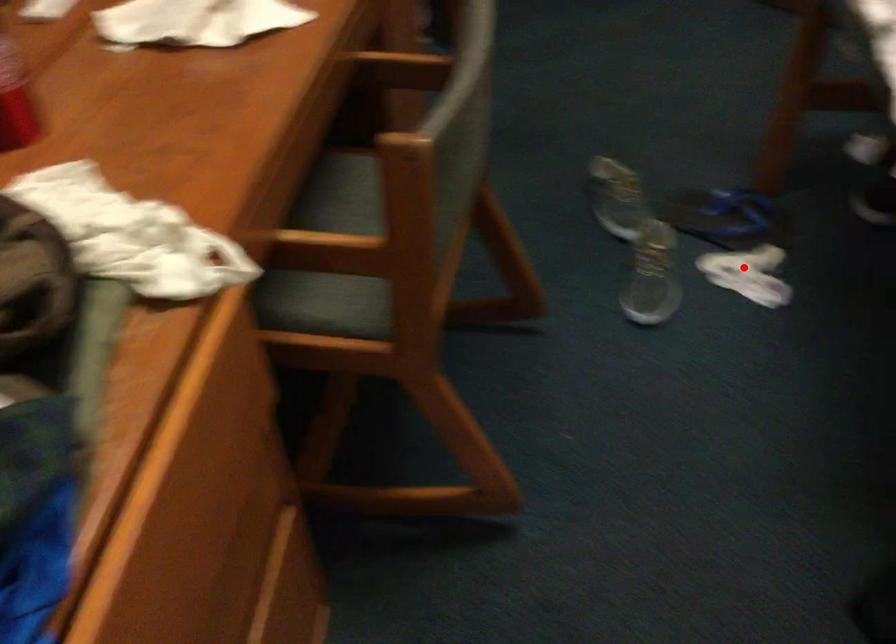
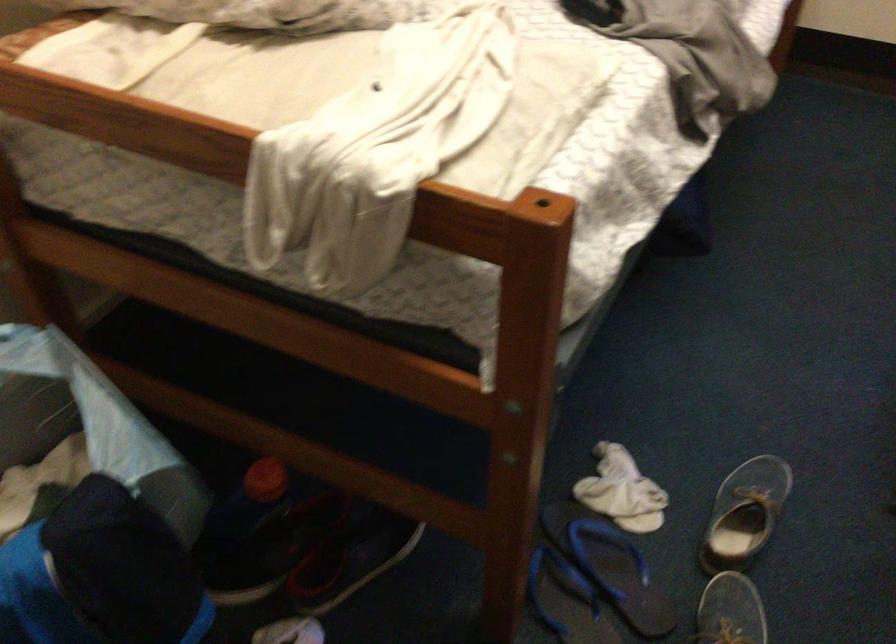
Question: I am providing you with two images of the same scene from different viewpoints. Image1 has a red point marked. In image2, the corresponding 3D location appears at what relative position? Reply with the corresponding letter.

Choices:
 (A) Closer
 (B) Farther

Answer: (A)